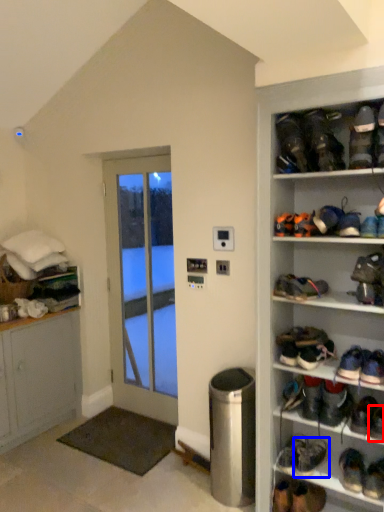
Question: Which object appears closest to the camera in this image, footwear (highlighted by a red box) or footwear (highlighted by a blue box)?

Choices:
 (A) footwear
 (B) footwear

Answer: (A)